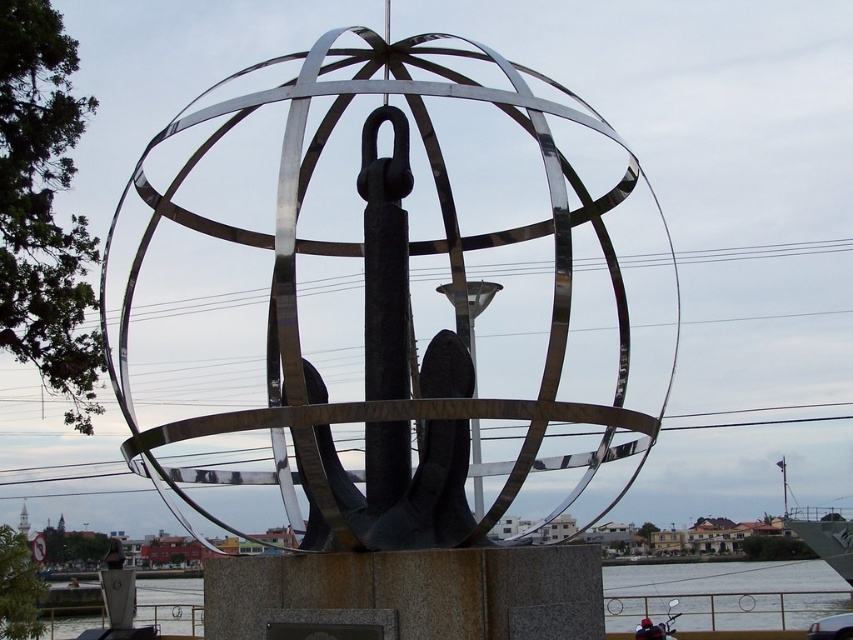
Does polished metal sphere at center lie behind transparent water at lower center?

No, it is in front of transparent water at lower center.

Which of these two, polished metal sphere at center or transparent water at lower center, stands shorter?

With less height is polished metal sphere at center.

Where is `polished metal sphere at center`? The height and width of the screenshot is (640, 853). polished metal sphere at center is located at coordinates (389, 314).